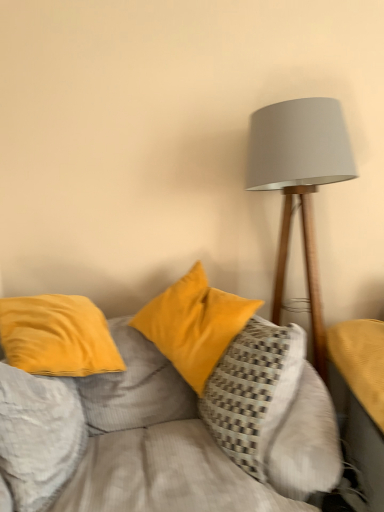
Describe the element at coordinates (162, 411) in the screenshot. The image size is (384, 512). I see `velvet yellow pillows at center` at that location.

Where is `velvet yellow pillows at center`? The height and width of the screenshot is (512, 384). velvet yellow pillows at center is located at coordinates (162, 411).

Measure the distance between velvet yellow pillow at center, which ranks as the second pillow in left-to-right order, and camera.

They are 1.65 meters apart.

The height and width of the screenshot is (512, 384). What do you see at coordinates (360, 399) in the screenshot?
I see `yellow fabric table at right` at bounding box center [360, 399].

Identify the location of velvet yellow pillow at center, which is the first pillow in right-to-left order. The height and width of the screenshot is (512, 384). (253, 390).

Identify the location of velvet yellow pillows at center. (162, 411).

Does velvet yellow pillows at center come in front of yellow fabric table at right?

Yes, the depth of velvet yellow pillows at center is less than that of yellow fabric table at right.

Is the surface of velvet yellow pillows at center in direct contact with yellow fabric table at right?

velvet yellow pillows at center is not next to yellow fabric table at right, and they're not touching.

From the image's perspective, is velvet yellow pillows at center under yellow fabric table at right?

Indeed, from the image's perspective, velvet yellow pillows at center is shown beneath yellow fabric table at right.

Find the location of `studio couch directly beneath the yellow fabric table at right (from a real-world perspective)`. studio couch directly beneath the yellow fabric table at right (from a real-world perspective) is located at coordinates (162, 411).

Between velvet yellow pillow at center, positioned as the 3th pillow in left-to-right order, and velvet yellow pillows at center, which one appears on the left side from the viewer's perspective?

velvet yellow pillows at center.

Is velvet yellow pillow at center, which is the first pillow in right-to-left order, directly adjacent to velvet yellow pillows at center?

No, velvet yellow pillow at center, which is the first pillow in right-to-left order, is not making contact with velvet yellow pillows at center.

At what (x,y) coordinates should I click in order to perform the action: click on the 1st pillow directly above the velvet yellow pillows at center (from a real-world perspective). Please return your answer as a coordinate pair (x, y). Looking at the image, I should click on (253, 390).

Considering the positions of objects velvet yellow pillow at center, which is the first pillow in right-to-left order, and velvet yellow pillows at center in the image provided, who is in front, velvet yellow pillow at center, which is the first pillow in right-to-left order, or velvet yellow pillows at center?

Positioned in front is velvet yellow pillows at center.

Image resolution: width=384 pixels, height=512 pixels. I want to click on pillow on the left of velvet yellow pillow at center, which ranks as the second pillow in left-to-right order, so (x=38, y=435).

Which is in front, point (152, 303) or point (56, 400)?

The point (56, 400) is in front.

How far apart are velvet yellow pillow at center, the 2th pillow in the right-to-left sequence, and velvet yellow pillow at left, acting as the first pillow starting from the left?

A distance of 22.03 inches exists between velvet yellow pillow at center, the 2th pillow in the right-to-left sequence, and velvet yellow pillow at left, acting as the first pillow starting from the left.

Which of these two, velvet yellow pillow at center, which ranks as the second pillow in left-to-right order, or velvet yellow pillow at left, acting as the first pillow starting from the left, is bigger?

velvet yellow pillow at center, which ranks as the second pillow in left-to-right order.

Which is correct: velvet yellow pillow at left, acting as the first pillow starting from the left, is inside velvet yellow pillows at center, or outside of it?

velvet yellow pillow at left, acting as the first pillow starting from the left, is located inside velvet yellow pillows at center.

Looking at this image, from their relative heights in the image, would you say velvet yellow pillow at left, acting as the first pillow starting from the left, is taller or shorter than velvet yellow pillows at center?

velvet yellow pillow at left, acting as the first pillow starting from the left, is shorter than velvet yellow pillows at center.

Based on the photo, from a real-world perspective, is velvet yellow pillow at left, acting as the first pillow starting from the left, positioned above or below velvet yellow pillows at center?

velvet yellow pillow at left, acting as the first pillow starting from the left, is situated higher than velvet yellow pillows at center in the real world.

Considering the points (277, 307) and (243, 462), which point is in front, point (277, 307) or point (243, 462)?

Positioned in front is point (243, 462).

Where is `lamp above the velvet yellow pillow at center, which is the first pillow in right-to-left order (from the image's perspective)`? The width and height of the screenshot is (384, 512). lamp above the velvet yellow pillow at center, which is the first pillow in right-to-left order (from the image's perspective) is located at coordinates (299, 184).

Consider the image. Which object is more forward, matte gray lampshade at right or velvet yellow pillow at center, positioned as the 3th pillow in left-to-right order?

velvet yellow pillow at center, positioned as the 3th pillow in left-to-right order, is more forward.

Is velvet yellow pillow at center, which is the first pillow in right-to-left order, far away from yellow fabric table at right?

No, velvet yellow pillow at center, which is the first pillow in right-to-left order, is not far away from yellow fabric table at right.

Can you confirm if velvet yellow pillow at center, positioned as the 3th pillow in left-to-right order, is wider than yellow fabric table at right?

No, velvet yellow pillow at center, positioned as the 3th pillow in left-to-right order, is not wider than yellow fabric table at right.

From a real-world perspective, which object rests below the other?

velvet yellow pillow at center, which is the first pillow in right-to-left order, is physically lower.

Relative to yellow fabric table at right, is velvet yellow pillow at center, positioned as the 3th pillow in left-to-right order, in front or behind?

velvet yellow pillow at center, positioned as the 3th pillow in left-to-right order, is behind yellow fabric table at right.

From the picture: Does velvet yellow pillow at left, acting as the first pillow starting from the left, have a lesser height compared to velvet yellow pillow at center, the 2th pillow in the right-to-left sequence?

Yes, velvet yellow pillow at left, acting as the first pillow starting from the left, is shorter than velvet yellow pillow at center, the 2th pillow in the right-to-left sequence.

Is velvet yellow pillow at left, acting as the first pillow starting from the left, next to velvet yellow pillow at center, which ranks as the second pillow in left-to-right order?

velvet yellow pillow at left, acting as the first pillow starting from the left, and velvet yellow pillow at center, which ranks as the second pillow in left-to-right order, are clearly separated.

Does velvet yellow pillow at left, acting as the first pillow starting from the left, have a larger size compared to velvet yellow pillow at center, which ranks as the second pillow in left-to-right order?

Actually, velvet yellow pillow at left, acting as the first pillow starting from the left, might be smaller than velvet yellow pillow at center, which ranks as the second pillow in left-to-right order.

At what (x,y) coordinates should I click in order to perform the action: click on studio couch that is under the yellow fabric table at right (from a real-world perspective). Please return your answer as a coordinate pair (x, y). Looking at the image, I should click on (162, 411).

Locate an element on the screen. The height and width of the screenshot is (512, 384). studio couch below the velvet yellow pillow at center, positioned as the 3th pillow in left-to-right order (from the image's perspective) is located at coordinates (162, 411).

Which object lies nearer to the anchor point velvet yellow pillow at center, the 2th pillow in the right-to-left sequence, matte gray lampshade at right or velvet yellow pillows at center?

velvet yellow pillows at center is closer to velvet yellow pillow at center, the 2th pillow in the right-to-left sequence.

When comparing their distances from velvet yellow pillow at center, which is the first pillow in right-to-left order, does velvet yellow pillow at center, which ranks as the second pillow in left-to-right order, or matte gray lampshade at right seem closer?

Among the two, velvet yellow pillow at center, which ranks as the second pillow in left-to-right order, is located nearer to velvet yellow pillow at center, which is the first pillow in right-to-left order.

Which object lies further to the anchor point velvet yellow pillow at center, the 2th pillow in the right-to-left sequence, velvet yellow pillow at left, the third pillow from the right, or yellow fabric table at right?

The object further to velvet yellow pillow at center, the 2th pillow in the right-to-left sequence, is yellow fabric table at right.

Estimate the real-world distances between objects in this image. Which object is closer to velvet yellow pillow at center, which is the first pillow in right-to-left order, velvet yellow pillow at center, the 2th pillow in the right-to-left sequence, or velvet yellow pillow at left, acting as the first pillow starting from the left?

velvet yellow pillow at center, the 2th pillow in the right-to-left sequence.

Considering their positions, is velvet yellow pillow at center, which is the first pillow in right-to-left order, positioned closer to velvet yellow pillow at left, acting as the first pillow starting from the left, than velvet yellow pillows at center?

Among the two, velvet yellow pillows at center is located nearer to velvet yellow pillow at left, acting as the first pillow starting from the left.

Based on their spatial positions, is velvet yellow pillow at center, the 2th pillow in the right-to-left sequence, or velvet yellow pillows at center further from velvet yellow pillow at left, the third pillow from the right?

velvet yellow pillow at center, the 2th pillow in the right-to-left sequence.

Estimate the real-world distances between objects in this image. Which object is closer to velvet yellow pillow at left, the third pillow from the right, yellow fabric table at right or velvet yellow pillow at center, positioned as the 3th pillow in left-to-right order?

Based on the image, velvet yellow pillow at center, positioned as the 3th pillow in left-to-right order, appears to be nearer to velvet yellow pillow at left, the third pillow from the right.

Which object lies further to the anchor point velvet yellow pillow at center, which is the first pillow in right-to-left order, yellow fabric table at right or matte gray lampshade at right?

Among the two, matte gray lampshade at right is located further to velvet yellow pillow at center, which is the first pillow in right-to-left order.

You are a GUI agent. You are given a task and a screenshot of the screen. Output one action in this format:
    pyautogui.click(x=<x>, y=<y>)
    Task: Click on the pillow between velvet yellow pillow at center, the 2th pillow in the right-to-left sequence, and yellow fabric table at right from left to right
    
    Given the screenshot: What is the action you would take?
    tap(253, 390)

In order to click on pillow located between velvet yellow pillow at center, the 2th pillow in the right-to-left sequence, and matte gray lampshade at right in the left-right direction in this screenshot , I will do `click(253, 390)`.

You are a GUI agent. You are given a task and a screenshot of the screen. Output one action in this format:
    pyautogui.click(x=<x>, y=<y>)
    Task: Click on the lamp located between velvet yellow pillow at left, the third pillow from the right, and yellow fabric table at right in the left-right direction
    This screenshot has width=384, height=512.
    Given the screenshot: What is the action you would take?
    pyautogui.click(x=299, y=184)

The height and width of the screenshot is (512, 384). I want to click on studio couch between velvet yellow pillow at left, acting as the first pillow starting from the left, and velvet yellow pillow at center, positioned as the 3th pillow in left-to-right order, in the horizontal direction, so click(162, 411).